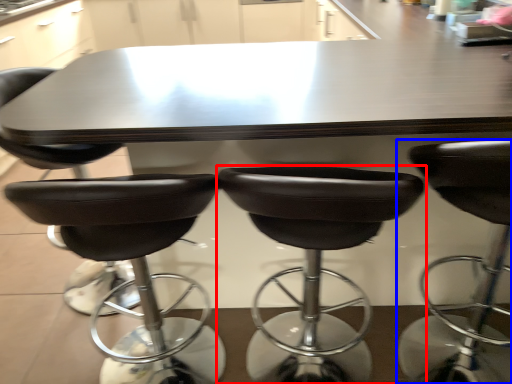
Question: Which object is closer to the camera taking this photo, chair (highlighted by a red box) or chair (highlighted by a blue box)?

Choices:
 (A) chair
 (B) chair

Answer: (B)